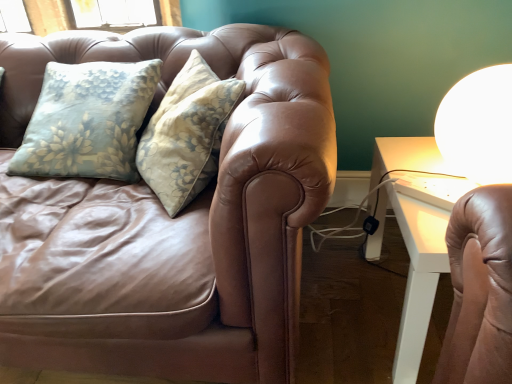
Question: From the image's perspective, is white glossy table lamp at upper right positioned above or below leather couch at left?

Choices:
 (A) below
 (B) above

Answer: (B)

Question: Visually, is white glossy table lamp at upper right positioned to the left or to the right of leather couch at left?

Choices:
 (A) right
 (B) left

Answer: (A)

Question: Is white glossy table lamp at upper right situated inside leather couch at left or outside?

Choices:
 (A) outside
 (B) inside

Answer: (A)

Question: Does point (245, 269) appear closer or farther from the camera than point (490, 165)?

Choices:
 (A) closer
 (B) farther

Answer: (A)

Question: Considering their positions, is leather couch at left located in front of or behind white glossy table lamp at upper right?

Choices:
 (A) front
 (B) behind

Answer: (A)

Question: Considering the positions of leather couch at left and white glossy table lamp at upper right in the image, is leather couch at left taller or shorter than white glossy table lamp at upper right?

Choices:
 (A) tall
 (B) short

Answer: (A)

Question: From a real-world perspective, is leather couch at left above or below white glossy table lamp at upper right?

Choices:
 (A) above
 (B) below

Answer: (B)